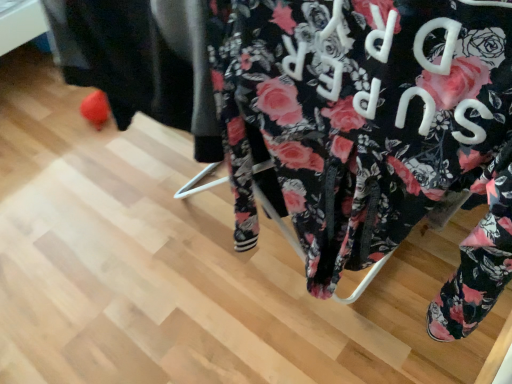
Identify the location of free region under floral fabric dress at upper center (from a real-world perspective). Image resolution: width=512 pixels, height=384 pixels. point(255,270).